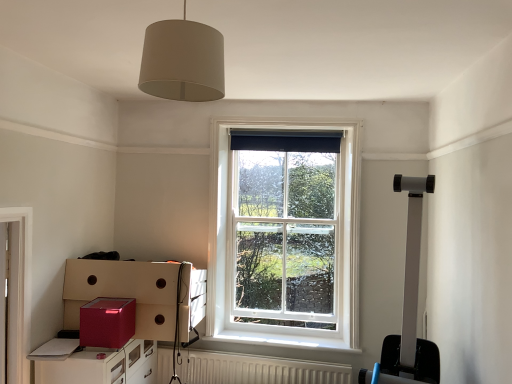
Identify the location of empty space that is ontop of white textured radiator at lower center. (262, 354).